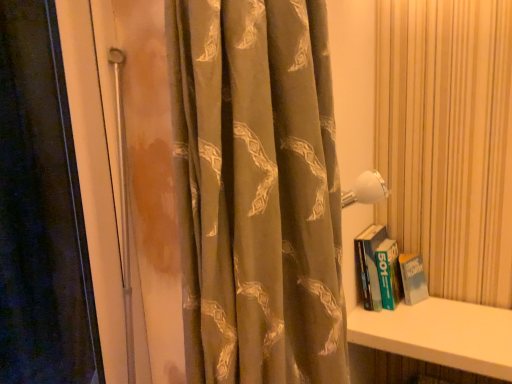
Find the location of a particular element. vacant area in front of green matte book at right is located at coordinates (419, 331).